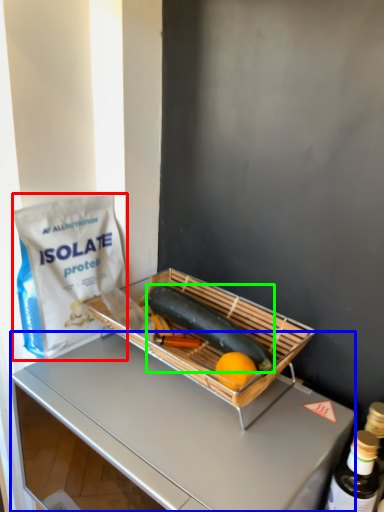
Question: Considering the real-world distances, which object is farthest from grocery bag (highlighted by a red box)? desk (highlighted by a blue box) or green vegetables (highlighted by a green box)?

Choices:
 (A) desk
 (B) green vegetables

Answer: (A)